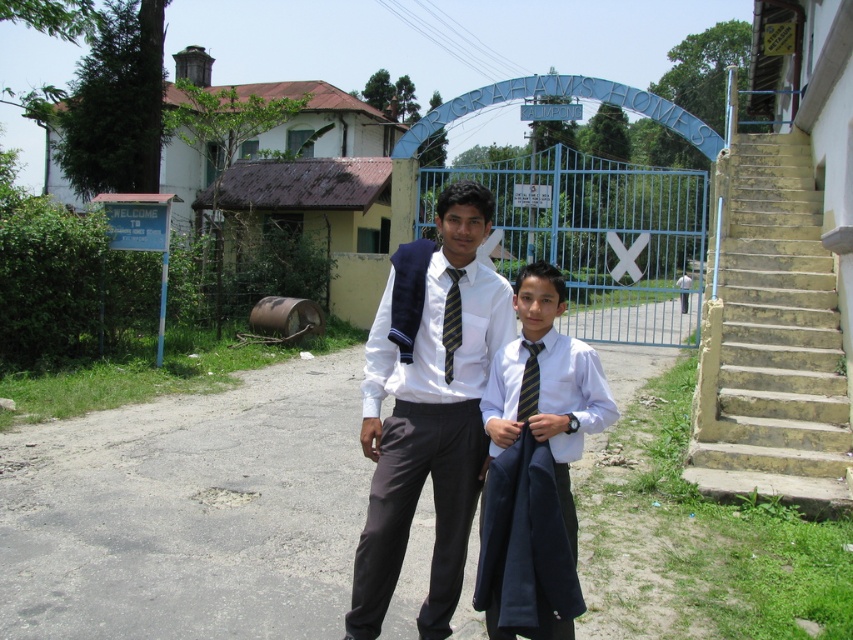
Measure the distance between yellow concrete stairs at right and striped fabric tie at center.

They are 11.97 feet apart.

Can you confirm if yellow concrete stairs at right is positioned to the left of striped fabric tie at center?

Incorrect, yellow concrete stairs at right is not on the left side of striped fabric tie at center.

Does point (730, 349) lie in front of point (531, 410)?

That is False.

Locate an element on the screen. yellow concrete stairs at right is located at coordinates (770, 337).

Between point (769, 388) and point (518, 316), which one is positioned in front?

Point (518, 316) is in front.

Does yellow concrete stairs at right come in front of white shirt and tie at center?

No, it is behind white shirt and tie at center.

Who is more distant from viewer, (782, 234) or (554, 627)?

The point (782, 234) is behind.

The height and width of the screenshot is (640, 853). In order to click on yellow concrete stairs at right in this screenshot , I will do `click(770, 337)`.

Measure the distance from white shirt and tie at center to yellow striped tie at center.

They are 27.34 centimeters apart.

Is white shirt and tie at center taller than yellow striped tie at center?

Yes, white shirt and tie at center is taller than yellow striped tie at center.

This screenshot has width=853, height=640. Describe the element at coordinates (520, 348) in the screenshot. I see `white shirt and tie at center` at that location.

This screenshot has height=640, width=853. I want to click on white shirt and tie at center, so click(520, 348).